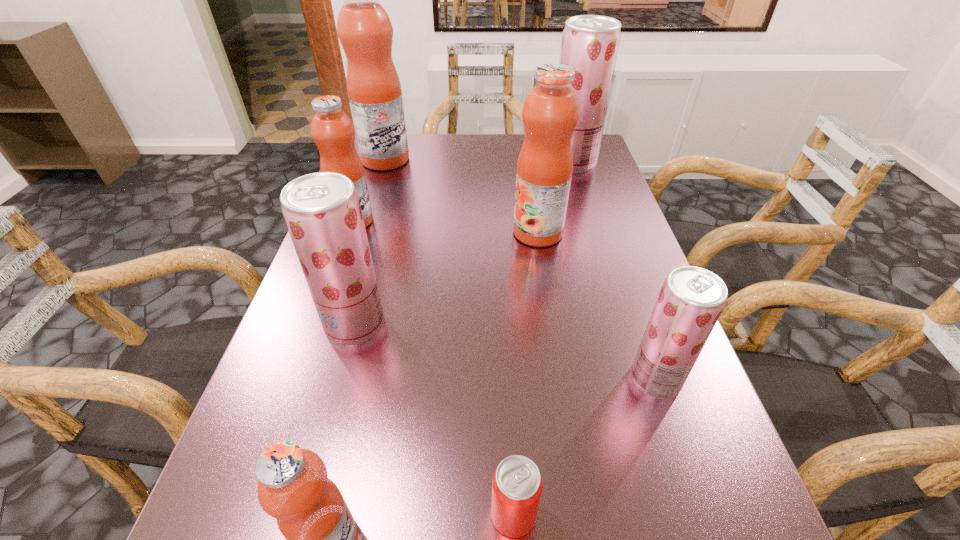
This screenshot has width=960, height=540. I want to click on vacant position located 0.360m on the left of the shortest object, so click(x=226, y=514).

The image size is (960, 540). Identify the location of object that is at the far left corner. (365, 31).

Image resolution: width=960 pixels, height=540 pixels. What are the coordinates of `object at the far right corner` in the screenshot? It's located at (590, 43).

Find the location of `free space at the left edge of the desktop`. free space at the left edge of the desktop is located at coordinates (380, 176).

Where is `vacant position at the right edge of the desktop`? vacant position at the right edge of the desktop is located at coordinates (612, 197).

This screenshot has width=960, height=540. What are the coordinates of `free spot between the leftmost strawberry fruit juice and the red can` in the screenshot? It's located at (434, 419).

At what (x,y) coordinates should I click in order to perform the action: click on free space between the leftmost strawberry fruit juice and the biggest orange fruit juice. Please return your answer as a coordinate pair (x, y). Image resolution: width=960 pixels, height=540 pixels. Looking at the image, I should click on (371, 242).

The height and width of the screenshot is (540, 960). What are the coordinates of `vacant space that's between the shortest object and the third biggest orange fruit juice` in the screenshot? It's located at (434, 368).

In order to click on free space between the sixth object from left to right and the second smallest orange fruit juice in this screenshot , I will do `click(445, 227)`.

At what (x,y) coordinates should I click in order to perform the action: click on object that is the closest one to the smallest orange fruit juice. Please return your answer as a coordinate pair (x, y). Looking at the image, I should click on (517, 485).